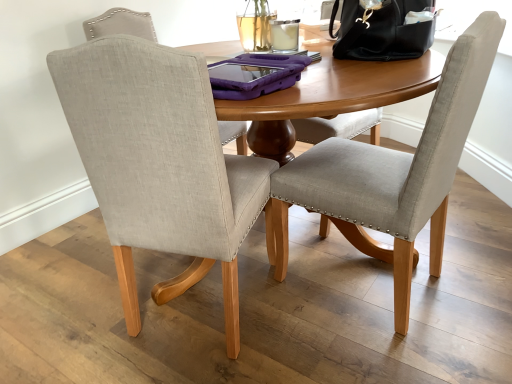
You are a GUI agent. You are given a task and a screenshot of the screen. Output one action in this format:
    pyautogui.click(x=<x>, y=<y>)
    Task: Click on the vacant space underneath beige fabric chair at center, the second chair in the right-to-left sequence (from a real-world perspective)
    The image size is (512, 384).
    Given the screenshot: What is the action you would take?
    pyautogui.click(x=216, y=302)